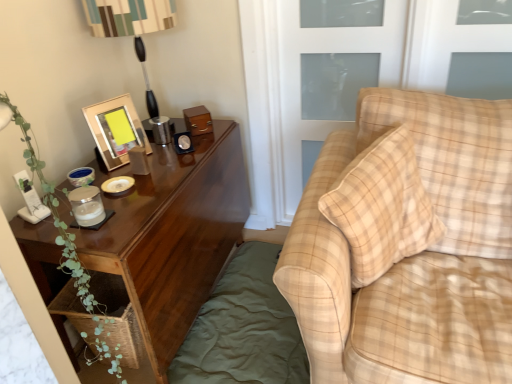
Find the location of a particular element. The width and height of the screenshot is (512, 384). vacant space to the right of woodenobject at upper left is located at coordinates (168, 153).